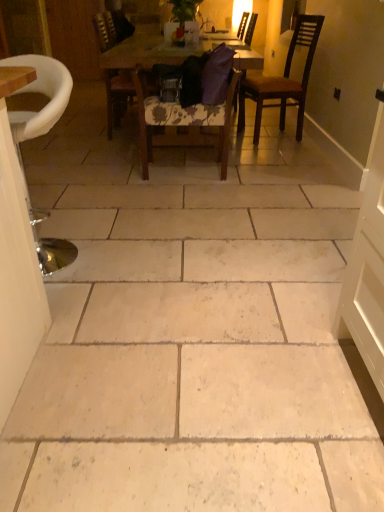
At what (x,y) coordinates should I click in order to perform the action: click on free area in between metallic silver stool at left, which is the 5th chair from back to front, and floral fabric chair at center, which is counted as the fourth chair, starting from the back. Please return your answer as a coordinate pair (x, y). The width and height of the screenshot is (384, 512). Looking at the image, I should click on (133, 210).